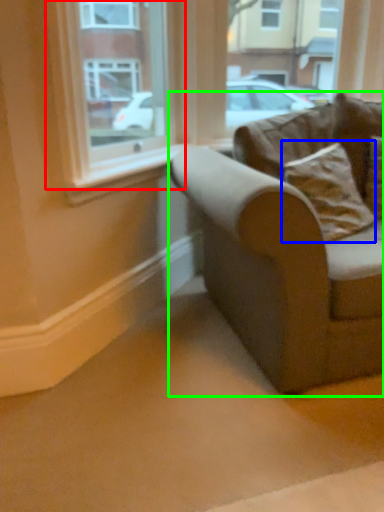
Question: Based on their relative distances, which object is nearer to window (highlighted by a red box)? Choose from pillow (highlighted by a blue box) and studio couch (highlighted by a green box).

Choices:
 (A) pillow
 (B) studio couch

Answer: (A)